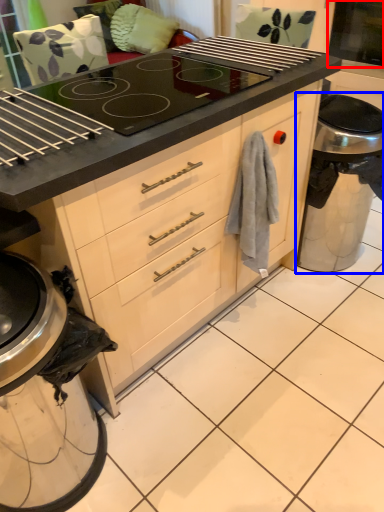
Question: Which object appears farthest to the camera in this image, screen door (highlighted by a red box) or appliance (highlighted by a blue box)?

Choices:
 (A) screen door
 (B) appliance

Answer: (A)